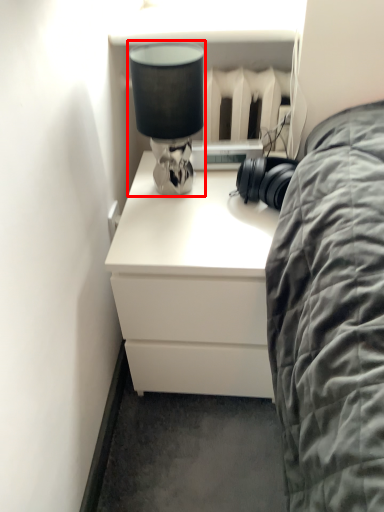
Question: From the image's perspective, what is the correct spatial positioning of table lamp (annotated by the red box) in reference to chest of drawers?

Choices:
 (A) above
 (B) below

Answer: (A)